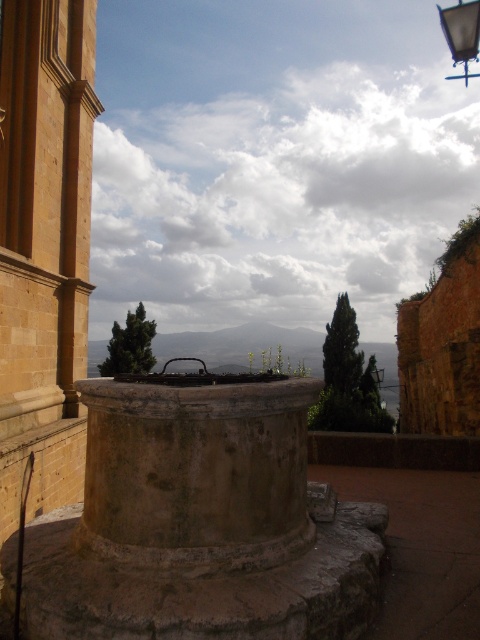
You are standing in front of the stone well and want to take a photo. You notice two points marked in the scene. The first point is at coordinates point (141, 508) and the second is at point (445, 13). Which point will appear larger in your photo?

Point (141, 508) will appear larger in the photo because it is closer to the camera than point (445, 13).

You are standing in a park and see the rustic stone well at center and the metallic streetlight at upper right. Which object is positioned higher in the image?

The metallic streetlight at upper right is positioned higher in the image than the rustic stone well at center.

You are standing in front of the rustic stone well at center. If you want to take a photo of it from a distance that is exactly 3 meters away, should you move closer or farther away?

The rustic stone well at center is currently 2.77 meters away. To achieve a distance of exactly 3 meters, you should move slightly farther away from the well.